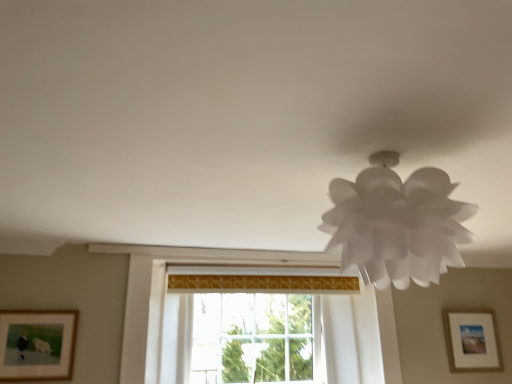
Question: Is white paper lamp at upper right positioned behind matte white picture frame at lower right, the second picture frame positioned from the front?

Choices:
 (A) yes
 (B) no

Answer: (B)

Question: From a real-world perspective, is white paper lamp at upper right beneath matte white picture frame at lower right, which ranks as the first picture frame in right-to-left order?

Choices:
 (A) no
 (B) yes

Answer: (A)

Question: Is white paper lamp at upper right far from matte white picture frame at lower right, the second picture frame when ordered from left to right?

Choices:
 (A) no
 (B) yes

Answer: (B)

Question: Considering the relative sizes of white paper lamp at upper right and matte white picture frame at lower right, positioned as the first picture frame in back-to-front order, in the image provided, is white paper lamp at upper right taller than matte white picture frame at lower right, positioned as the first picture frame in back-to-front order,?

Choices:
 (A) no
 (B) yes

Answer: (A)

Question: From the image's perspective, does white paper lamp at upper right appear lower than matte white picture frame at lower right, the second picture frame when ordered from left to right?

Choices:
 (A) yes
 (B) no

Answer: (B)

Question: Is white paper lamp at upper right to the left of matte white picture frame at lower right, positioned as the first picture frame in back-to-front order, from the viewer's perspective?

Choices:
 (A) yes
 (B) no

Answer: (A)

Question: Is white paper lamp at upper right facing towards wooden framed picture at lower left, the first picture frame positioned from the front?

Choices:
 (A) yes
 (B) no

Answer: (B)

Question: Is white paper lamp at upper right smaller than wooden framed picture at lower left, the first picture frame positioned from the front?

Choices:
 (A) yes
 (B) no

Answer: (B)

Question: Does white paper lamp at upper right appear on the right side of wooden framed picture at lower left, the first picture frame positioned from the front?

Choices:
 (A) yes
 (B) no

Answer: (A)

Question: From a real-world perspective, is white paper lamp at upper right located beneath wooden framed picture at lower left, marked as the 2th picture frame in a back-to-front arrangement?

Choices:
 (A) yes
 (B) no

Answer: (B)

Question: Is white paper lamp at upper right facing away from wooden framed picture at lower left, marked as the 2th picture frame in a back-to-front arrangement?

Choices:
 (A) no
 (B) yes

Answer: (A)

Question: Considering the relative sizes of white paper lamp at upper right and wooden framed picture at lower left, marked as the 2th picture frame in a back-to-front arrangement, in the image provided, is white paper lamp at upper right thinner than wooden framed picture at lower left, marked as the 2th picture frame in a back-to-front arrangement,?

Choices:
 (A) no
 (B) yes

Answer: (A)

Question: Could you tell me if wooden framed picture at lower left, marked as the 2th picture frame in a back-to-front arrangement, is turned towards white paper lamp at upper right?

Choices:
 (A) yes
 (B) no

Answer: (B)